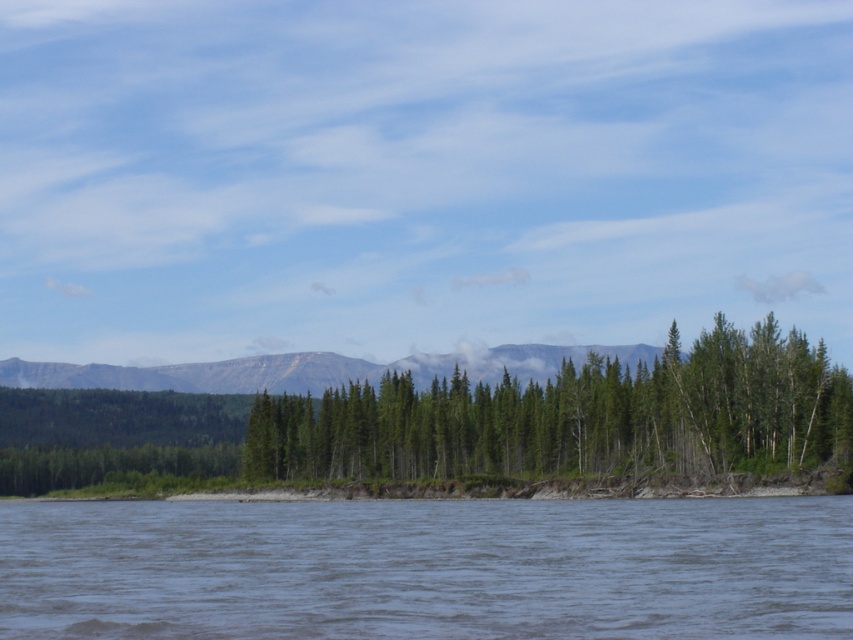
Question: Is green matte trees at center behind rocky gray mountain at center?

Choices:
 (A) no
 (B) yes

Answer: (A)

Question: Is gray water at lower center thinner than green matte trees at center?

Choices:
 (A) no
 (B) yes

Answer: (A)

Question: Considering the real-world distances, which object is closest to the gray water at lower center?

Choices:
 (A) rocky gray mountain at center
 (B) green matte trees at center

Answer: (B)

Question: Is gray water at lower center to the left of rocky gray mountain at center from the viewer's perspective?

Choices:
 (A) yes
 (B) no

Answer: (A)

Question: Based on their relative distances, which object is farther from the gray water at lower center?

Choices:
 (A) green matte trees at center
 (B) rocky gray mountain at center

Answer: (B)

Question: Which of these objects is positioned farthest from the rocky gray mountain at center?

Choices:
 (A) gray water at lower center
 (B) green matte trees at center

Answer: (A)